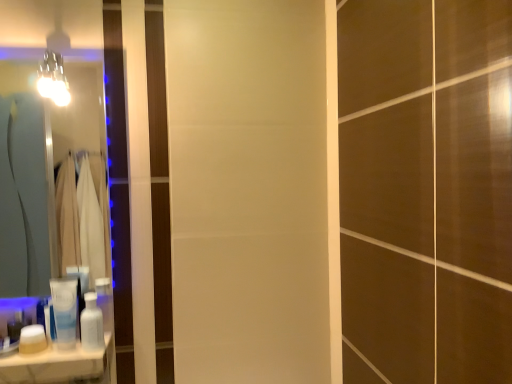
Locate an element on the screen. The image size is (512, 384). white glossy bottle at lower left, positioned as the third toiletry in left-to-right order is located at coordinates (92, 324).

Identify the location of matte glass mirror at left. This screenshot has height=384, width=512. (45, 176).

What do you see at coordinates (65, 311) in the screenshot?
I see `white glossy lotion at lower left, placed as the 2th toiletry when sorted from left to right` at bounding box center [65, 311].

Measure the distance between white matte jar at lower left, marked as the first toiletry in a left-to-right arrangement, and camera.

The depth of white matte jar at lower left, marked as the first toiletry in a left-to-right arrangement, is 3.34 feet.

You are a GUI agent. You are given a task and a screenshot of the screen. Output one action in this format:
    pyautogui.click(x=<x>, y=<y>)
    Task: Click on the metallic glass light fixture at upper left
    This screenshot has width=512, height=384.
    Given the screenshot: What is the action you would take?
    pyautogui.click(x=53, y=79)

What do you see at coordinates (58, 366) in the screenshot? I see `white glossy counter top at lower left` at bounding box center [58, 366].

Where is `white glossy bottle at lower left, the first toiletry viewed from the right`? This screenshot has width=512, height=384. white glossy bottle at lower left, the first toiletry viewed from the right is located at coordinates (92, 324).

From the image's perspective, is white matte jar at lower left, positioned as the third toiletry in right-to-left order, beneath metallic glass light fixture at upper left?

Yes, from the image's perspective, white matte jar at lower left, positioned as the third toiletry in right-to-left order, is beneath metallic glass light fixture at upper left.

Would you consider white matte jar at lower left, positioned as the third toiletry in right-to-left order, to be distant from metallic glass light fixture at upper left?

That's right, there is a large distance between white matte jar at lower left, positioned as the third toiletry in right-to-left order, and metallic glass light fixture at upper left.

In the scene shown: From a real-world perspective, is white matte jar at lower left, positioned as the third toiletry in right-to-left order, beneath metallic glass light fixture at upper left?

Indeed, from a real-world perspective, white matte jar at lower left, positioned as the third toiletry in right-to-left order, is positioned beneath metallic glass light fixture at upper left.

Which object is closer to the camera taking this photo, white matte jar at lower left, positioned as the third toiletry in right-to-left order, or metallic glass light fixture at upper left?

white matte jar at lower left, positioned as the third toiletry in right-to-left order, is in front.

Considering the relative sizes of white glossy bottle at lower left, the first toiletry viewed from the right, and white matte jar at lower left, marked as the first toiletry in a left-to-right arrangement, in the image provided, is white glossy bottle at lower left, the first toiletry viewed from the right, thinner than white matte jar at lower left, marked as the first toiletry in a left-to-right arrangement,?

Incorrect, the width of white glossy bottle at lower left, the first toiletry viewed from the right, is not less than that of white matte jar at lower left, marked as the first toiletry in a left-to-right arrangement.

Can you confirm if white glossy bottle at lower left, the first toiletry viewed from the right, is positioned to the left of white matte jar at lower left, positioned as the third toiletry in right-to-left order?

No, white glossy bottle at lower left, the first toiletry viewed from the right, is not to the left of white matte jar at lower left, positioned as the third toiletry in right-to-left order.

Is white glossy bottle at lower left, positioned as the third toiletry in left-to-right order, oriented towards white matte jar at lower left, positioned as the third toiletry in right-to-left order?

No.

Based on the photo, can white matte jar at lower left, marked as the first toiletry in a left-to-right arrangement, be found inside white glossy bottle at lower left, positioned as the third toiletry in left-to-right order?

Actually, white matte jar at lower left, marked as the first toiletry in a left-to-right arrangement, is outside white glossy bottle at lower left, positioned as the third toiletry in left-to-right order.

Is white glossy counter top at lower left smaller than white glossy bottle at lower left, the first toiletry viewed from the right?

No, white glossy counter top at lower left is not smaller than white glossy bottle at lower left, the first toiletry viewed from the right.

Based on the photo, can you confirm if white glossy counter top at lower left is thinner than white glossy bottle at lower left, positioned as the third toiletry in left-to-right order?

Incorrect, the width of white glossy counter top at lower left is not less than that of white glossy bottle at lower left, positioned as the third toiletry in left-to-right order.

Is white glossy counter top at lower left with white glossy bottle at lower left, the first toiletry viewed from the right?

Yes, white glossy counter top at lower left is touching white glossy bottle at lower left, the first toiletry viewed from the right.

Is white glossy counter top at lower left located outside white glossy bottle at lower left, positioned as the third toiletry in left-to-right order?

Absolutely, white glossy counter top at lower left is external to white glossy bottle at lower left, positioned as the third toiletry in left-to-right order.

Would you say white glossy lotion at lower left, placed as the 2th toiletry when sorted from left to right, is outside white matte jar at lower left, positioned as the third toiletry in right-to-left order?

white glossy lotion at lower left, placed as the 2th toiletry when sorted from left to right, is positioned outside white matte jar at lower left, positioned as the third toiletry in right-to-left order.

Is point (51, 292) less distant than point (44, 340)?

No, (51, 292) is further to viewer.

Who is smaller, white glossy lotion at lower left, which is the second toiletry from right to left, or white matte jar at lower left, positioned as the third toiletry in right-to-left order?

white matte jar at lower left, positioned as the third toiletry in right-to-left order, is smaller.

Are white glossy lotion at lower left, which is the second toiletry from right to left, and matte glass mirror at left making contact?

No, white glossy lotion at lower left, which is the second toiletry from right to left, is not with matte glass mirror at left.

From a real-world perspective, is white glossy lotion at lower left, placed as the 2th toiletry when sorted from left to right, under matte glass mirror at left?

Correct, in the physical world, white glossy lotion at lower left, placed as the 2th toiletry when sorted from left to right, is lower than matte glass mirror at left.

Considering the sizes of objects white glossy lotion at lower left, which is the second toiletry from right to left, and matte glass mirror at left in the image provided, who is smaller, white glossy lotion at lower left, which is the second toiletry from right to left, or matte glass mirror at left?

white glossy lotion at lower left, which is the second toiletry from right to left, is smaller.

Measure the distance between white glossy lotion at lower left, which is the second toiletry from right to left, and matte glass mirror at left.

white glossy lotion at lower left, which is the second toiletry from right to left, is 1.34 meters from matte glass mirror at left.

Could you measure the distance between white matte jar at lower left, positioned as the third toiletry in right-to-left order, and white glossy counter top at lower left?

white matte jar at lower left, positioned as the third toiletry in right-to-left order, and white glossy counter top at lower left are 3.49 inches apart.

Can you confirm if white matte jar at lower left, marked as the first toiletry in a left-to-right arrangement, is wider than white glossy counter top at lower left?

In fact, white matte jar at lower left, marked as the first toiletry in a left-to-right arrangement, might be narrower than white glossy counter top at lower left.

What's the angular difference between white matte jar at lower left, positioned as the third toiletry in right-to-left order, and white glossy counter top at lower left's facing directions?

There is a 3.8-degree angle between the facing directions of white matte jar at lower left, positioned as the third toiletry in right-to-left order, and white glossy counter top at lower left.

From the image's perspective, is white matte jar at lower left, positioned as the third toiletry in right-to-left order, beneath white glossy counter top at lower left?

Actually, white matte jar at lower left, positioned as the third toiletry in right-to-left order, appears above white glossy counter top at lower left in the image.

From the image's perspective, which one is positioned lower, matte glass mirror at left or white matte jar at lower left, marked as the first toiletry in a left-to-right arrangement?

From the image's view, white matte jar at lower left, marked as the first toiletry in a left-to-right arrangement, is below.

This screenshot has height=384, width=512. Find the location of `the 3rd toiletry in front when counting from the matte glass mirror at left`. the 3rd toiletry in front when counting from the matte glass mirror at left is located at coordinates pos(32,339).

Measure the distance from matte glass mirror at left to white matte jar at lower left, marked as the first toiletry in a left-to-right arrangement.

matte glass mirror at left and white matte jar at lower left, marked as the first toiletry in a left-to-right arrangement, are 4.48 feet apart.

Based on the photo, how many degrees apart are the facing directions of matte glass mirror at left and white matte jar at lower left, positioned as the third toiletry in right-to-left order?

They differ by 3.8 degrees in their facing directions.

Locate an element on the screen. This screenshot has height=384, width=512. light fixture behind the white matte jar at lower left, marked as the first toiletry in a left-to-right arrangement is located at coordinates (53, 79).

Where is `toiletry directly beneath the white glossy bottle at lower left, the first toiletry viewed from the right (from a real-world perspective)`? This screenshot has width=512, height=384. toiletry directly beneath the white glossy bottle at lower left, the first toiletry viewed from the right (from a real-world perspective) is located at coordinates (32, 339).

Looking at the image, which one is located further to white matte jar at lower left, positioned as the third toiletry in right-to-left order, white glossy bottle at lower left, positioned as the third toiletry in left-to-right order, or metallic glass light fixture at upper left?

metallic glass light fixture at upper left.

Looking at the image, which one is located further to white glossy lotion at lower left, placed as the 2th toiletry when sorted from left to right, metallic glass light fixture at upper left or white glossy counter top at lower left?

metallic glass light fixture at upper left lies further to white glossy lotion at lower left, placed as the 2th toiletry when sorted from left to right, than the other object.

From the image, which object appears to be nearer to white glossy lotion at lower left, which is the second toiletry from right to left, matte glass mirror at left or metallic glass light fixture at upper left?

matte glass mirror at left is positioned closer to the anchor white glossy lotion at lower left, which is the second toiletry from right to left.

When comparing their distances from white glossy bottle at lower left, positioned as the third toiletry in left-to-right order, does matte glass mirror at left or metallic glass light fixture at upper left seem further?

metallic glass light fixture at upper left is positioned further to the anchor white glossy bottle at lower left, positioned as the third toiletry in left-to-right order.

Considering their positions, is white matte jar at lower left, marked as the first toiletry in a left-to-right arrangement, positioned closer to matte glass mirror at left than metallic glass light fixture at upper left?

Based on the image, metallic glass light fixture at upper left appears to be nearer to matte glass mirror at left.

When comparing their distances from white glossy bottle at lower left, the first toiletry viewed from the right, does white glossy lotion at lower left, placed as the 2th toiletry when sorted from left to right, or white glossy counter top at lower left seem closer?

white glossy lotion at lower left, placed as the 2th toiletry when sorted from left to right, is positioned closer to the anchor white glossy bottle at lower left, the first toiletry viewed from the right.

Estimate the real-world distances between objects in this image. Which object is further from matte glass mirror at left, white matte jar at lower left, positioned as the third toiletry in right-to-left order, or white glossy counter top at lower left?

The object further to matte glass mirror at left is white matte jar at lower left, positioned as the third toiletry in right-to-left order.

Based on their spatial positions, is white matte jar at lower left, positioned as the third toiletry in right-to-left order, or metallic glass light fixture at upper left further from white glossy bottle at lower left, positioned as the third toiletry in left-to-right order?

metallic glass light fixture at upper left is further to white glossy bottle at lower left, positioned as the third toiletry in left-to-right order.

The width and height of the screenshot is (512, 384). I want to click on toiletry between white glossy counter top at lower left and white glossy bottle at lower left, positioned as the third toiletry in left-to-right order, from left to right, so click(x=65, y=311).

You are a GUI agent. You are given a task and a screenshot of the screen. Output one action in this format:
    pyautogui.click(x=<x>, y=<y>)
    Task: Click on the counter top situated between white matte jar at lower left, marked as the first toiletry in a left-to-right arrangement, and white glossy bottle at lower left, positioned as the third toiletry in left-to-right order, from left to right
    
    Given the screenshot: What is the action you would take?
    pyautogui.click(x=58, y=366)

Where is `mirror between metallic glass light fixture at upper left and white glossy bottle at lower left, positioned as the third toiletry in left-to-right order, vertically`? mirror between metallic glass light fixture at upper left and white glossy bottle at lower left, positioned as the third toiletry in left-to-right order, vertically is located at coordinates (45, 176).

Where is `toiletry located between white matte jar at lower left, marked as the first toiletry in a left-to-right arrangement, and white glossy bottle at lower left, positioned as the third toiletry in left-to-right order, in the left-right direction`? toiletry located between white matte jar at lower left, marked as the first toiletry in a left-to-right arrangement, and white glossy bottle at lower left, positioned as the third toiletry in left-to-right order, in the left-right direction is located at coordinates (x=65, y=311).